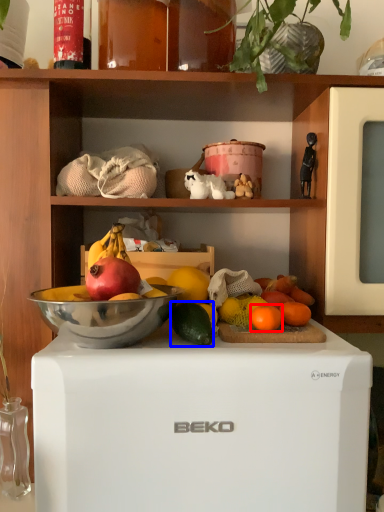
Question: Which point is closer to the camera, grapefruit (highlighted by a red box) or avocado (highlighted by a blue box)?

Choices:
 (A) grapefruit
 (B) avocado

Answer: (B)